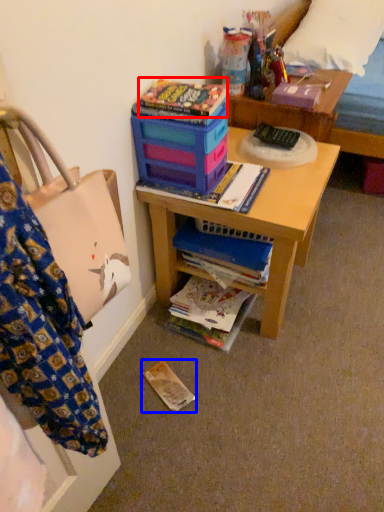
Question: Which point is further to the camera, paperback book (highlighted by a red box) or paperback book (highlighted by a blue box)?

Choices:
 (A) paperback book
 (B) paperback book

Answer: (B)